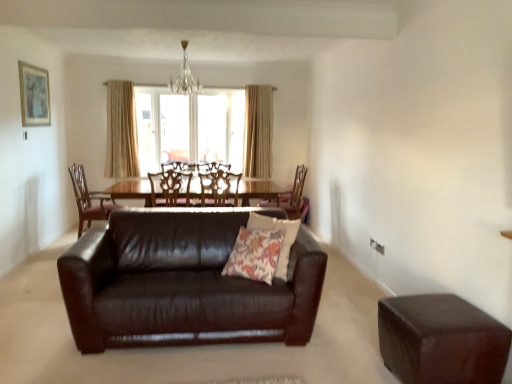
Based on the photo, in order to face wooden chair at center, marked as the 4th chair in a left-to-right arrangement, should I rotate leftwards or rightwards?

Turn right approximately 3.579 degrees to face it.

Find the location of a particular element. The image size is (512, 384). mahogany wood chair at center, arranged as the first chair when viewed from the left is located at coordinates (89, 199).

Identify the location of wooden chair at center, the third chair from the left. (219, 189).

Identify the location of brown leather chair at center, acting as the 2th chair starting from the left. 170,188.

Where is `brown leather couch at center`? The image size is (512, 384). brown leather couch at center is located at coordinates (182, 284).

What are the coordinates of `wooden chair at center, the first chair in the right-to-left sequence` in the screenshot? It's located at (293, 195).

Is brown leather couch at center located outside floral fabric pillow at center?

Yes, brown leather couch at center is located beyond the bounds of floral fabric pillow at center.

Is brown leather couch at center smaller than floral fabric pillow at center?

No, brown leather couch at center is not smaller than floral fabric pillow at center.

Is brown leather couch at center facing away from floral fabric pillow at center?

Yes, floral fabric pillow at center is at the back of brown leather couch at center.

From the image's perspective, between brown leather couch at center and floral fabric pillow at center, which one is located above?

floral fabric pillow at center.

Can you see wooden chair at center, the third chair from the left, touching brown leather couch at center?

No, wooden chair at center, the third chair from the left, is not touching brown leather couch at center.

Could you measure the distance between wooden chair at center, the third chair from the left, and brown leather couch at center?

wooden chair at center, the third chair from the left, is 1.61 meters from brown leather couch at center.

At what (x,y) coordinates should I click in order to perform the action: click on studio couch located below the wooden chair at center, the third chair from the left (from the image's perspective). Please return your answer as a coordinate pair (x, y). The height and width of the screenshot is (384, 512). Looking at the image, I should click on (182, 284).

Considering the sizes of wooden chair at center, which appears as the 2th chair when viewed from the right, and brown leather couch at center in the image, is wooden chair at center, which appears as the 2th chair when viewed from the right, bigger or smaller than brown leather couch at center?

wooden chair at center, which appears as the 2th chair when viewed from the right, is smaller than brown leather couch at center.

Looking at this image, can you tell me how much wooden chair at center, the third chair from the left, and wooden chair at center, marked as the 4th chair in a left-to-right arrangement, differ in facing direction?

93.3 degrees separate the facing orientations of wooden chair at center, the third chair from the left, and wooden chair at center, marked as the 4th chair in a left-to-right arrangement.

Between wooden chair at center, the third chair from the left, and wooden chair at center, the first chair in the right-to-left sequence, which one appears on the left side from the viewer's perspective?

Positioned to the left is wooden chair at center, the third chair from the left.

From a real-world perspective, is wooden chair at center, the third chair from the left, located higher than wooden chair at center, the first chair in the right-to-left sequence?

Correct, in the physical world, wooden chair at center, the third chair from the left, is higher than wooden chair at center, the first chair in the right-to-left sequence.

Is wooden chair at center, which appears as the 2th chair when viewed from the right, next to wooden chair at center, the first chair in the right-to-left sequence?

wooden chair at center, which appears as the 2th chair when viewed from the right, and wooden chair at center, the first chair in the right-to-left sequence, are clearly separated.

Would you consider matte wooden picture frame at upper left to be distant from translucent glass window at center?

That's right, there is a large distance between matte wooden picture frame at upper left and translucent glass window at center.

This screenshot has height=384, width=512. What are the coordinates of `picture frame located in front of the translucent glass window at center` in the screenshot? It's located at click(34, 95).

Is matte wooden picture frame at upper left oriented towards translucent glass window at center?

No, matte wooden picture frame at upper left does not turn towards translucent glass window at center.

Which object is closer to the camera taking this photo, matte wooden picture frame at upper left or translucent glass window at center?

matte wooden picture frame at upper left is in front.

From the picture: Can we say matte wooden picture frame at upper left lies outside brown leather ottoman at lower right?

Yes, matte wooden picture frame at upper left is not within brown leather ottoman at lower right.

From a real-world perspective, is matte wooden picture frame at upper left under brown leather ottoman at lower right?

Incorrect, from a real-world perspective, matte wooden picture frame at upper left is higher than brown leather ottoman at lower right.

Would you say matte wooden picture frame at upper left is a long distance from brown leather ottoman at lower right?

Yes.

Looking at this image, is matte wooden picture frame at upper left shorter than brown leather ottoman at lower right?

No, matte wooden picture frame at upper left is not shorter than brown leather ottoman at lower right.

From the image's perspective, is beige fabric curtain at upper center, the second curtain when ordered from left to right, located beneath beige fabric curtain at upper center, which ranks as the first curtain in left-to-right order?

No, from the image's perspective, beige fabric curtain at upper center, the second curtain when ordered from left to right, is not below beige fabric curtain at upper center, which ranks as the first curtain in left-to-right order.

Which object is closer to the camera, beige fabric curtain at upper center, which ranks as the first curtain in right-to-left order, or beige fabric curtain at upper center, which ranks as the first curtain in left-to-right order?

beige fabric curtain at upper center, which ranks as the first curtain in left-to-right order, is more forward.

Can you tell me how much beige fabric curtain at upper center, which ranks as the first curtain in right-to-left order, and beige fabric curtain at upper center, acting as the second curtain starting from the right, differ in facing direction?

beige fabric curtain at upper center, which ranks as the first curtain in right-to-left order, and beige fabric curtain at upper center, acting as the second curtain starting from the right, are facing 1.39 degrees away from each other.

Between point (272, 108) and point (112, 95), which one is positioned behind?

Point (272, 108)

Is floral fabric pillow at center to the left of beige fabric curtain at upper center, which ranks as the first curtain in right-to-left order, from the viewer's perspective?

Yes, floral fabric pillow at center is to the left of beige fabric curtain at upper center, which ranks as the first curtain in right-to-left order.

Considering the sizes of floral fabric pillow at center and beige fabric curtain at upper center, which ranks as the first curtain in right-to-left order, in the image, is floral fabric pillow at center bigger or smaller than beige fabric curtain at upper center, which ranks as the first curtain in right-to-left order,?

In the image, floral fabric pillow at center appears to be smaller than beige fabric curtain at upper center, which ranks as the first curtain in right-to-left order.

Is floral fabric pillow at center far from beige fabric curtain at upper center, which ranks as the first curtain in right-to-left order?

floral fabric pillow at center is positioned a significant distance from beige fabric curtain at upper center, which ranks as the first curtain in right-to-left order.

Image resolution: width=512 pixels, height=384 pixels. I want to click on curtain that is the 2nd one when counting upward from the floral fabric pillow at center (from the image's perspective), so click(x=258, y=131).

Where is `pillow that appears on the right of brown leather couch at center`? The image size is (512, 384). pillow that appears on the right of brown leather couch at center is located at coordinates (283, 240).

Find the location of a particular element. Image resolution: width=512 pixels, height=384 pixels. the 3rd chair above the brown leather couch at center (from a real-world perspective) is located at coordinates (219, 189).

When comparing their distances from matte wooden picture frame at upper left, does wooden chair at center, the first chair in the right-to-left sequence, or floral fabric pillow at center seem closer?

floral fabric pillow at center lies closer to matte wooden picture frame at upper left than the other object.

From the image, which object appears to be nearer to brown leather couch at center, mahogany wood chair at center, arranged as the first chair when viewed from the left, or wooden chair at center, marked as the 4th chair in a left-to-right arrangement?

mahogany wood chair at center, arranged as the first chair when viewed from the left, is closer to brown leather couch at center.

From the picture: From the image, which object appears to be nearer to brown leather chair at center, positioned as the 3th chair in right-to-left order, mahogany wood chair at center, which is the fourth chair from right to left, or beige fabric curtain at upper center, which ranks as the first curtain in right-to-left order?

Based on the image, mahogany wood chair at center, which is the fourth chair from right to left, appears to be nearer to brown leather chair at center, positioned as the 3th chair in right-to-left order.

Estimate the real-world distances between objects in this image. Which object is closer to wooden chair at center, marked as the 4th chair in a left-to-right arrangement, brown leather couch at center or translucent glass window at center?

translucent glass window at center is closer to wooden chair at center, marked as the 4th chair in a left-to-right arrangement.

When comparing their distances from translucent glass window at center, does wooden chair at center, the first chair in the right-to-left sequence, or wooden chair at center, which appears as the 2th chair when viewed from the right, seem further?

The object further to translucent glass window at center is wooden chair at center, which appears as the 2th chair when viewed from the right.

Considering their positions, is matte wooden picture frame at upper left positioned further to wooden chair at center, the third chair from the left, than brown leather ottoman at lower right?

Based on the image, brown leather ottoman at lower right appears to be further to wooden chair at center, the third chair from the left.

Estimate the real-world distances between objects in this image. Which object is further from brown leather ottoman at lower right, matte wooden picture frame at upper left or wooden chair at center, the third chair from the left?

Based on the image, matte wooden picture frame at upper left appears to be further to brown leather ottoman at lower right.

When comparing their distances from wooden chair at center, which appears as the 2th chair when viewed from the right, does mahogany wood chair at center, which is the fourth chair from right to left, or translucent glass window at center seem further?

translucent glass window at center is further to wooden chair at center, which appears as the 2th chair when viewed from the right.

I want to click on pillow between brown leather ottoman at lower right and beige fabric curtain at upper center, which ranks as the first curtain in right-to-left order, along the z-axis, so click(283, 240).

You are a GUI agent. You are given a task and a screenshot of the screen. Output one action in this format:
    pyautogui.click(x=<x>, y=<y>)
    Task: Click on the picture frame positioned between brown leather ottoman at lower right and translucent glass window at center from near to far
    The image size is (512, 384).
    Given the screenshot: What is the action you would take?
    pyautogui.click(x=34, y=95)

In order to click on curtain between beige fabric curtain at upper center, which ranks as the first curtain in left-to-right order, and wooden chair at center, marked as the 4th chair in a left-to-right arrangement in this screenshot , I will do `click(258, 131)`.

I want to click on pillow located between brown leather ottoman at lower right and translucent glass window at center in the depth direction, so click(283, 240).